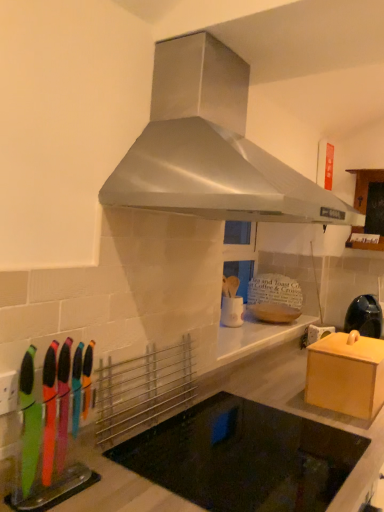
In order to face wooden box at right, the second cabinetry when ordered from top to bottom, should I rotate leftwards or rightwards?

You should look right and rotate roughly 21.113 degrees.

Find the location of a particular element. Image resolution: width=384 pixels, height=512 pixels. wooden cabinet at upper right, arranged as the first cabinetry when viewed from the back is located at coordinates (369, 208).

Describe the element at coordinates (211, 147) in the screenshot. I see `stainless steel range hood at upper center` at that location.

Locate an element on the screen. The image size is (384, 512). black glass cooktop at center is located at coordinates (244, 457).

Does matte black kettle at right have a lesser height compared to wooden box at right, marked as the 1th cabinetry in a left-to-right arrangement?

No, matte black kettle at right is not shorter than wooden box at right, marked as the 1th cabinetry in a left-to-right arrangement.

Can we say matte black kettle at right lies outside wooden box at right, the 2th cabinetry when ordered from back to front?

Indeed, matte black kettle at right is completely outside wooden box at right, the 2th cabinetry when ordered from back to front.

How far apart are matte black kettle at right and wooden box at right, the second cabinetry when ordered from top to bottom?

A distance of 34.16 inches exists between matte black kettle at right and wooden box at right, the second cabinetry when ordered from top to bottom.

From a real-world perspective, which object rests below the other?

black glass cooktop at center is physically lower.

Is point (352, 325) closer to viewer compared to point (238, 409)?

No, it is not.

How different are the orientations of matte black kettle at right and black glass cooktop at center in degrees?

The angle between the facing direction of matte black kettle at right and the facing direction of black glass cooktop at center is 53.8 degrees.

Can you confirm if matte black kettle at right is positioned to the right of black glass cooktop at center?

Yes, matte black kettle at right is to the right of black glass cooktop at center.

Considering the sizes of black glass cooktop at center and wooden box at right, the second cabinetry when ordered from top to bottom, in the image, is black glass cooktop at center taller or shorter than wooden box at right, the second cabinetry when ordered from top to bottom,?

Considering their sizes, black glass cooktop at center has more height than wooden box at right, the second cabinetry when ordered from top to bottom.

Considering the points (236, 496) and (361, 382), which point is in front, point (236, 496) or point (361, 382)?

Positioned in front is point (236, 496).

Considering the sizes of objects black glass cooktop at center and wooden box at right, marked as the 1th cabinetry in a left-to-right arrangement, in the image provided, who is thinner, black glass cooktop at center or wooden box at right, marked as the 1th cabinetry in a left-to-right arrangement,?

wooden box at right, marked as the 1th cabinetry in a left-to-right arrangement, is thinner.

How many degrees apart are the facing directions of black glass cooktop at center and wooden box at right, the second cabinetry when ordered from top to bottom?

The angular difference between black glass cooktop at center and wooden box at right, the second cabinetry when ordered from top to bottom, is 1.34 degrees.

Between point (355, 409) and point (233, 74), which one is positioned in front?

Positioned in front is point (233, 74).

From the image's perspective, does wooden box at right, positioned as the 1th cabinetry in front-to-back order, appear higher than stainless steel range hood at upper center?

No, from the image's perspective, wooden box at right, positioned as the 1th cabinetry in front-to-back order, is not over stainless steel range hood at upper center.

Are wooden box at right, positioned as the 1th cabinetry in front-to-back order, and stainless steel range hood at upper center located far from each other?

That's not correct — wooden box at right, positioned as the 1th cabinetry in front-to-back order, is a little close to stainless steel range hood at upper center.

From their relative heights in the image, would you say wooden box at right, the 2th cabinetry when ordered from back to front, is taller or shorter than stainless steel range hood at upper center?

Considering their sizes, wooden box at right, the 2th cabinetry when ordered from back to front, has less height than stainless steel range hood at upper center.

From the image's perspective, is matte black kettle at right located above or below stainless steel range hood at upper center?

From the image's perspective, matte black kettle at right appears below stainless steel range hood at upper center.

Can you confirm if matte black kettle at right is taller than stainless steel range hood at upper center?

No, matte black kettle at right is not taller than stainless steel range hood at upper center.

Image resolution: width=384 pixels, height=512 pixels. In order to click on home appliance that is on the left side of matte black kettle at right in this screenshot , I will do `click(211, 147)`.

Is matte black kettle at right in front of or behind stainless steel range hood at upper center in the image?

Visually, matte black kettle at right is located behind stainless steel range hood at upper center.

Who is smaller, wooden cabinet at upper right, acting as the first cabinetry starting from the right, or stainless steel range hood at upper center?

wooden cabinet at upper right, acting as the first cabinetry starting from the right, is smaller.

Considering the relative positions of wooden cabinet at upper right, acting as the first cabinetry starting from the right, and stainless steel range hood at upper center in the image provided, is wooden cabinet at upper right, acting as the first cabinetry starting from the right, to the right of stainless steel range hood at upper center from the viewer's perspective?

Yes, wooden cabinet at upper right, acting as the first cabinetry starting from the right, is to the right of stainless steel range hood at upper center.

This screenshot has width=384, height=512. Identify the location of home appliance on the left side of wooden cabinet at upper right, positioned as the 2th cabinetry in bottom-to-top order. (211, 147).

Looking at this image, considering the relative sizes of wooden cabinet at upper right, positioned as the 2th cabinetry in front-to-back order, and stainless steel range hood at upper center in the image provided, is wooden cabinet at upper right, positioned as the 2th cabinetry in front-to-back order, taller than stainless steel range hood at upper center?

No, wooden cabinet at upper right, positioned as the 2th cabinetry in front-to-back order, is not taller than stainless steel range hood at upper center.

Based on their sizes in the image, would you say black glass cooktop at center is bigger or smaller than matte black kettle at right?

In the image, black glass cooktop at center appears to be larger than matte black kettle at right.

I want to click on appliance on the left of matte black kettle at right, so (244, 457).

Does black glass cooktop at center have a greater width compared to matte black kettle at right?

Indeed, black glass cooktop at center has a greater width compared to matte black kettle at right.

At what (x,y) coordinates should I click in order to perform the action: click on kitchen appliance lying behind the wooden box at right, the 2th cabinetry when ordered from back to front. Please return your answer as a coordinate pair (x, y). The height and width of the screenshot is (512, 384). Looking at the image, I should click on (364, 316).

I want to click on appliance directly beneath the matte black kettle at right (from a real-world perspective), so (x=244, y=457).

Estimate the real-world distances between objects in this image. Which object is further from wooden box at right, marked as the 1th cabinetry in a left-to-right arrangement, wooden cabinet at upper right, arranged as the first cabinetry when viewed from the back, or matte black kettle at right?

Among the two, wooden cabinet at upper right, arranged as the first cabinetry when viewed from the back, is located further to wooden box at right, marked as the 1th cabinetry in a left-to-right arrangement.

Based on their spatial positions, is wooden box at right, positioned as the 1th cabinetry in front-to-back order, or stainless steel range hood at upper center closer to wooden cabinet at upper right, positioned as the 2th cabinetry in bottom-to-top order?

wooden box at right, positioned as the 1th cabinetry in front-to-back order, lies closer to wooden cabinet at upper right, positioned as the 2th cabinetry in bottom-to-top order, than the other object.

Based on their spatial positions, is wooden cabinet at upper right, positioned as the 2th cabinetry in front-to-back order, or stainless steel range hood at upper center closer to matte black kettle at right?

wooden cabinet at upper right, positioned as the 2th cabinetry in front-to-back order, lies closer to matte black kettle at right than the other object.

Which object lies nearer to the anchor point matte black kettle at right, wooden box at right, positioned as the 1th cabinetry in front-to-back order, or stainless steel range hood at upper center?

wooden box at right, positioned as the 1th cabinetry in front-to-back order.

Estimate the real-world distances between objects in this image. Which object is closer to stainless steel range hood at upper center, wooden box at right, which ranks as the 2th cabinetry in right-to-left order, or matte black kettle at right?

wooden box at right, which ranks as the 2th cabinetry in right-to-left order, is closer to stainless steel range hood at upper center.

When comparing their distances from wooden box at right, the second cabinetry when ordered from top to bottom, does stainless steel range hood at upper center or matte black kettle at right seem further?

matte black kettle at right.

Based on their spatial positions, is black glass cooktop at center or stainless steel range hood at upper center closer to wooden box at right, positioned as the 1th cabinetry in front-to-back order?

Among the two, black glass cooktop at center is located nearer to wooden box at right, positioned as the 1th cabinetry in front-to-back order.

Considering their positions, is matte black kettle at right positioned closer to wooden box at right, the 1th cabinetry from the bottom, than wooden cabinet at upper right, arranged as the first cabinetry when viewed from the back?

matte black kettle at right is closer to wooden box at right, the 1th cabinetry from the bottom.

I want to click on cabinetry between black glass cooktop at center and wooden cabinet at upper right, positioned as the 2th cabinetry in bottom-to-top order, from front to back, so click(x=346, y=374).

Identify the location of cabinetry between black glass cooktop at center and matte black kettle at right along the z-axis. (346, 374).

This screenshot has width=384, height=512. Identify the location of kitchen appliance between black glass cooktop at center and wooden cabinet at upper right, which is counted as the second cabinetry, starting from the left, along the z-axis. (364, 316).

At what (x,y) coordinates should I click in order to perform the action: click on cabinetry between stainless steel range hood at upper center and matte black kettle at right from front to back. Please return your answer as a coordinate pair (x, y). Image resolution: width=384 pixels, height=512 pixels. Looking at the image, I should click on (346, 374).